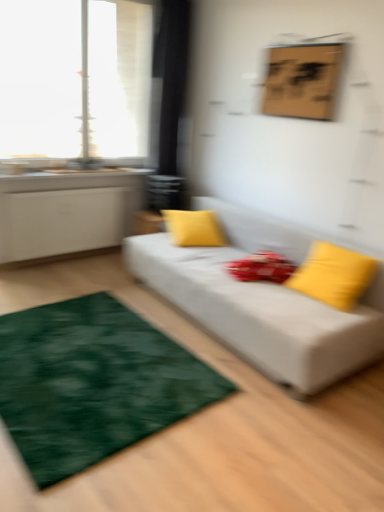
I want to click on vacant area on the back side of green plush rug at lower left, so click(85, 282).